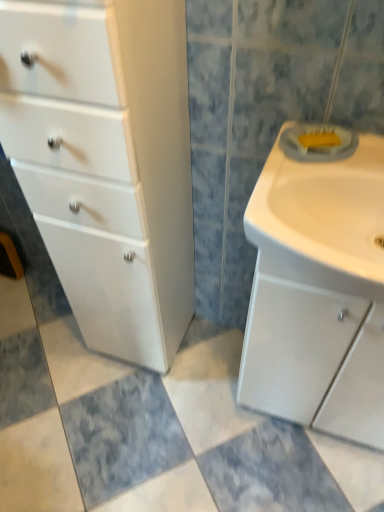
Where is `free location above white glossy sink at right (from a real-world perspective)`? The image size is (384, 512). free location above white glossy sink at right (from a real-world perspective) is located at coordinates (321, 165).